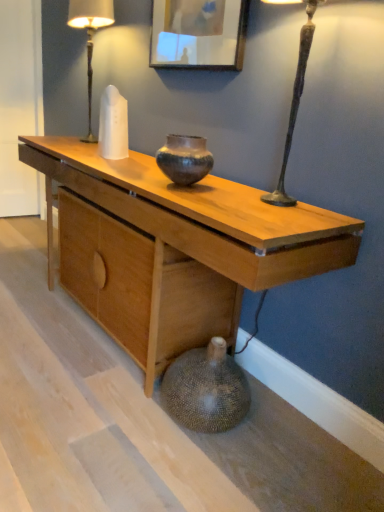
This screenshot has width=384, height=512. I want to click on vacant region in front of natural wood desk at center, so click(x=100, y=413).